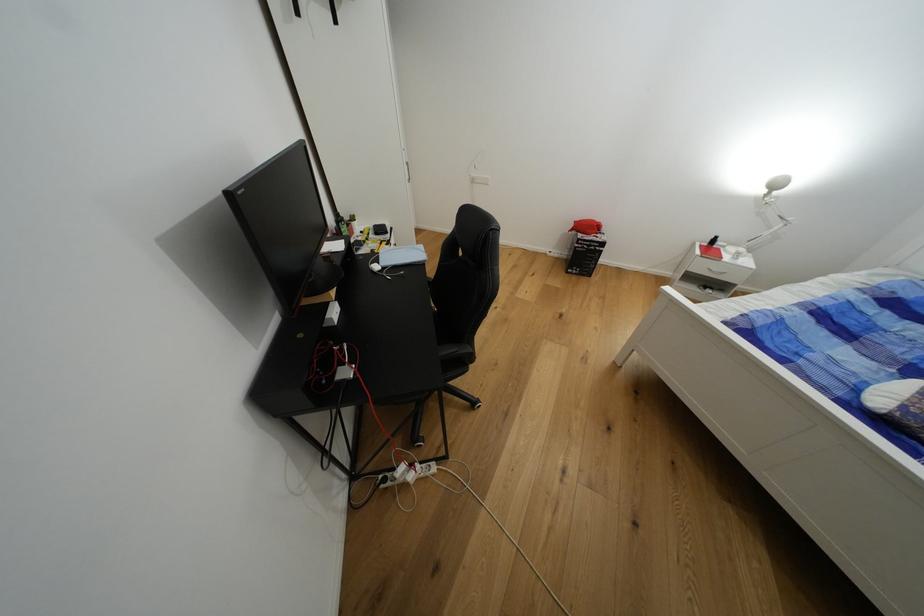
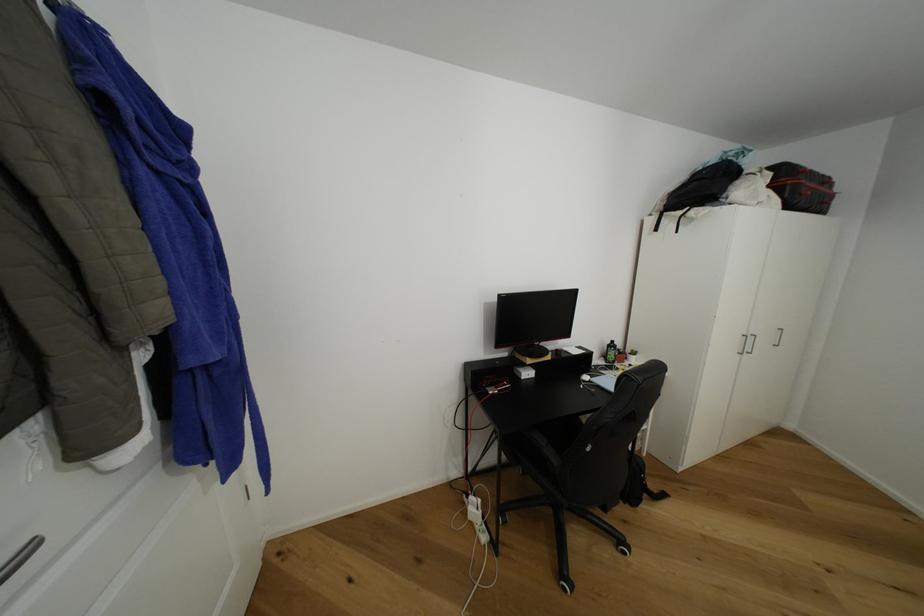
Question: The images are taken continuously from a first-person perspective. In which direction is your viewpoint rotating?

Choices:
 (A) Left
 (B) Right
 (C) Up
 (D) Down

Answer: (A)